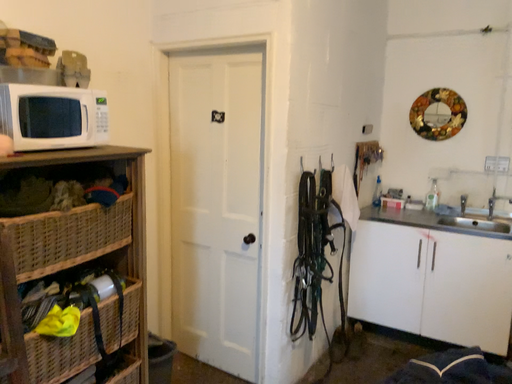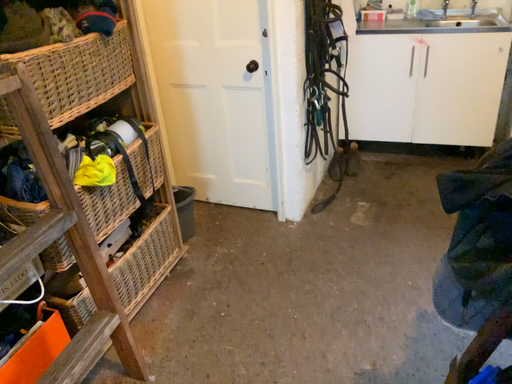
Question: How did the camera likely rotate when shooting the video?

Choices:
 (A) rotated left
 (B) rotated right

Answer: (B)